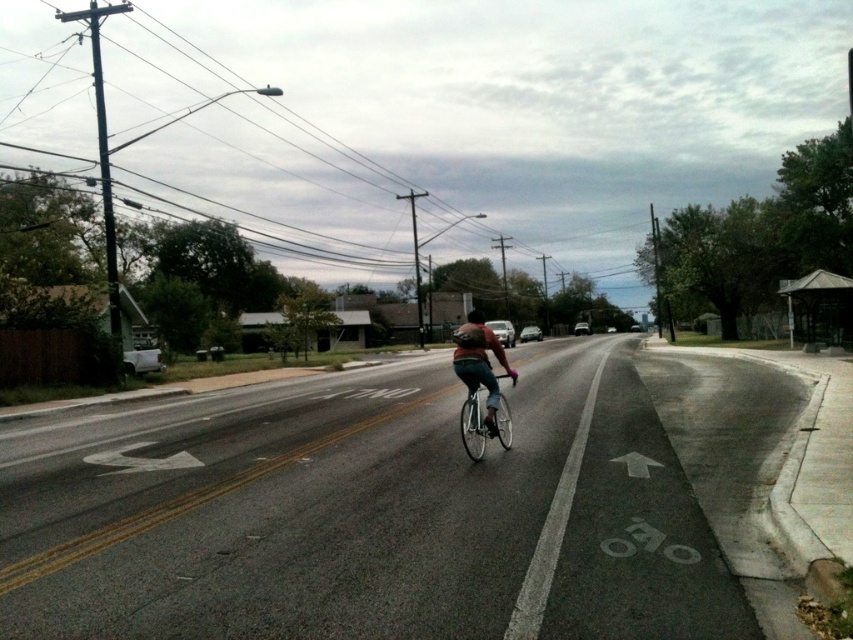
Consider the image. You are a delivery person who needs to load a matte black bicycle at center and a black matte bicycle helmet at center into a small storage locker. The locker has a height limit of 1.2 meters. Can both items fit vertically without exceeding the height limit?

The matte black bicycle at center is much taller than the black matte bicycle helmet at center. Since the locker has a height limit of 1.2 meters, only the black matte bicycle helmet at center can fit vertically. The matte black bicycle at center exceeds the height limit and cannot be stored in the locker.

You are a pedestrian standing at the point with coordinates point (474,404) and want to cross the road to reach the other side. Is the point point (486,433) closer to you or further away?

The point (486,433) is further to the viewer than point (474,404), so it is further away from you.

You are standing at the point labeled as point (505,362) on the road. You want to walk to a nearby bench located 10 feet away from you. However, there is a cyclist in the bike lane. Can you safely walk to the bench without entering the bike lane?

The point labeled (505,362) is 34.20 feet away from the viewer. Since the bench is only 10 feet away from you, you are still far from the point and the cyclist, so you can safely walk to the bench without entering the bike lane.